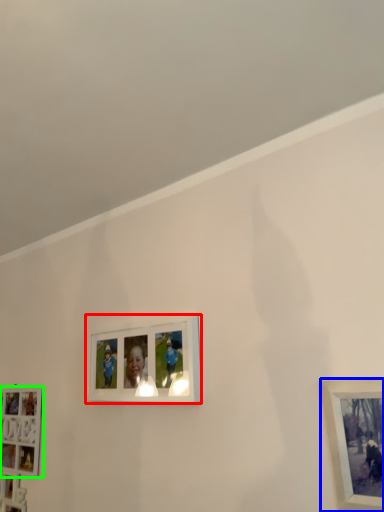
Question: Which object is positioned farthest from picture frame (highlighted by a red box)? Select from picture frame (highlighted by a blue box) and picture frame (highlighted by a green box).

Choices:
 (A) picture frame
 (B) picture frame

Answer: (A)